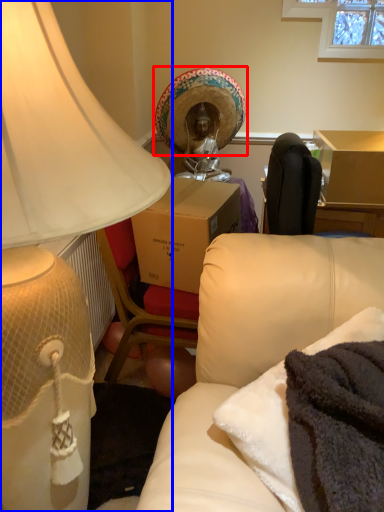
Question: Which point is further to the camera, headdress (highlighted by a red box) or lamp (highlighted by a blue box)?

Choices:
 (A) headdress
 (B) lamp

Answer: (A)